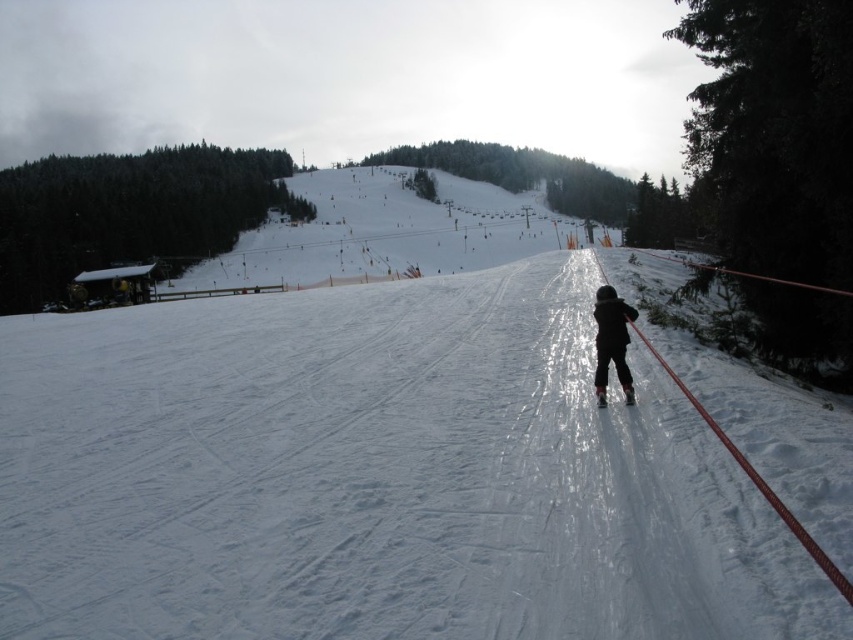
You are a beginner skier standing at the edge of the slope. You notice the white smooth snow at center and the matte black ski at center. Which object is closer to you as you prepare to start skiing?

The white smooth snow at center is closer to you because it is positioned in front of the matte black ski at center.

You are a parent watching your child at the ski slope. You see the white smooth snow at center and the black matte snowsuit at center. Which object is positioned to the left?

The white smooth snow at center is to the left of the black matte snowsuit at center.